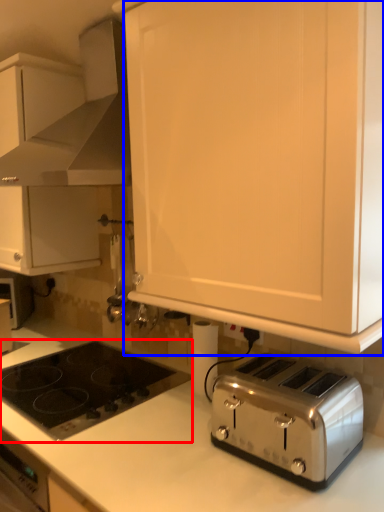
Question: Among these objects, which one is nearest to the camera, gas stove (highlighted by a red box) or cabinetry (highlighted by a blue box)?

Choices:
 (A) gas stove
 (B) cabinetry

Answer: (B)